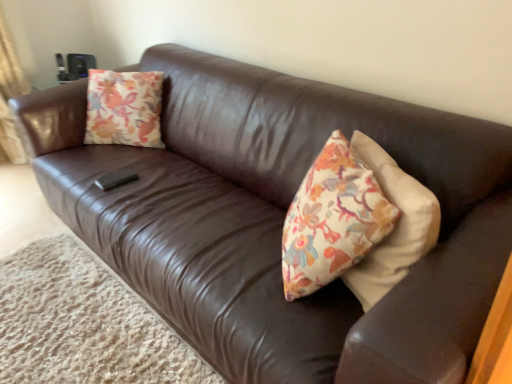
Question: Is brown leather couch at lower left smaller than floral-patterned fabric pillow at upper left?

Choices:
 (A) no
 (B) yes

Answer: (A)

Question: From a real-world perspective, is brown leather couch at lower left beneath floral-patterned fabric pillow at upper left?

Choices:
 (A) yes
 (B) no

Answer: (A)

Question: From a real-world perspective, is brown leather couch at lower left over floral-patterned fabric pillow at upper left?

Choices:
 (A) no
 (B) yes

Answer: (A)

Question: Does brown leather couch at lower left lie behind floral-patterned fabric pillow at upper left?

Choices:
 (A) no
 (B) yes

Answer: (A)

Question: Considering the relative sizes of brown leather couch at lower left and floral-patterned fabric pillow at upper left in the image provided, is brown leather couch at lower left taller than floral-patterned fabric pillow at upper left?

Choices:
 (A) no
 (B) yes

Answer: (A)

Question: Can you confirm if brown leather couch at lower left is shorter than floral-patterned fabric pillow at upper left?

Choices:
 (A) no
 (B) yes

Answer: (B)

Question: From a real-world perspective, is floral-patterned fabric pillow at upper left positioned under brown leather couch at lower left based on gravity?

Choices:
 (A) yes
 (B) no

Answer: (B)

Question: From the image's perspective, would you say floral-patterned fabric pillow at upper left is shown under brown leather couch at lower left?

Choices:
 (A) no
 (B) yes

Answer: (A)

Question: Considering the relative positions of floral-patterned fabric pillow at upper left and brown leather couch at lower left in the image provided, is floral-patterned fabric pillow at upper left to the left of brown leather couch at lower left from the viewer's perspective?

Choices:
 (A) no
 (B) yes

Answer: (A)

Question: Does floral-patterned fabric pillow at upper left have a greater width compared to brown leather couch at lower left?

Choices:
 (A) yes
 (B) no

Answer: (B)

Question: Is floral-patterned fabric pillow at upper left facing towards brown leather couch at lower left?

Choices:
 (A) no
 (B) yes

Answer: (A)

Question: Considering the relative sizes of floral-patterned fabric pillow at upper left and brown leather couch at lower left in the image provided, is floral-patterned fabric pillow at upper left thinner than brown leather couch at lower left?

Choices:
 (A) no
 (B) yes

Answer: (B)

Question: In terms of height, does floral-patterned fabric pillow at upper left look taller or shorter compared to brown leather couch at lower left?

Choices:
 (A) short
 (B) tall

Answer: (B)